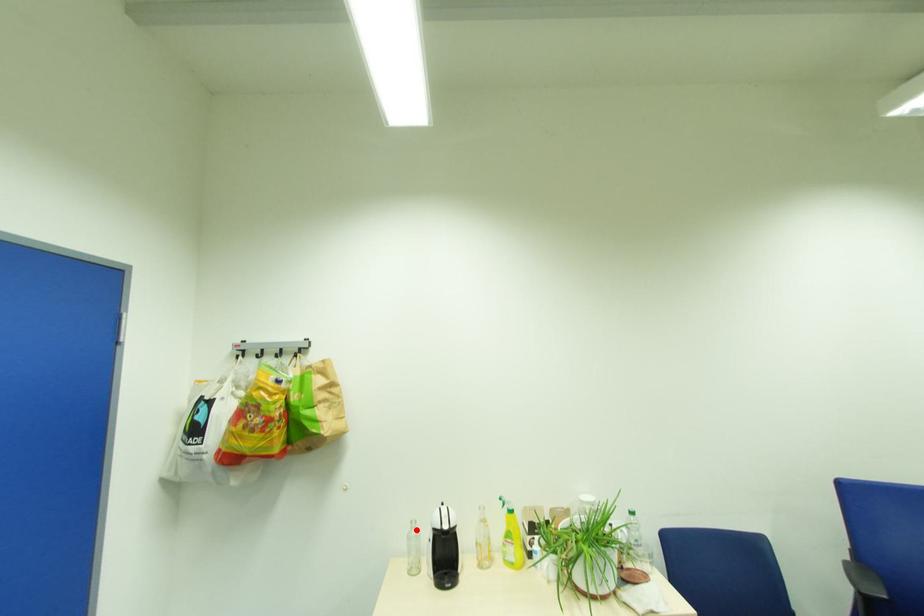
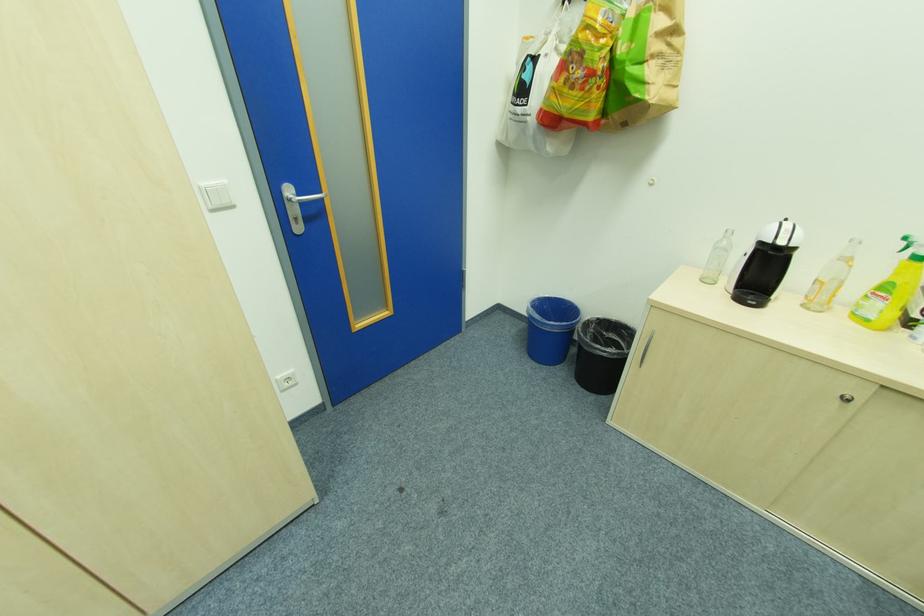
In the second image, find the point that corresponds to the highlighted location in the first image.

(728, 238)